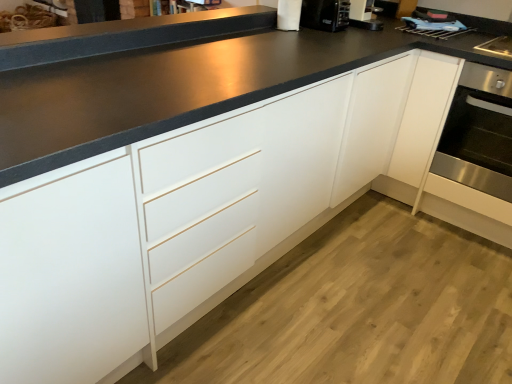
This screenshot has height=384, width=512. I want to click on free area in between white paper towel at upper center and black plastic coffee machine at upper right, so click(x=306, y=35).